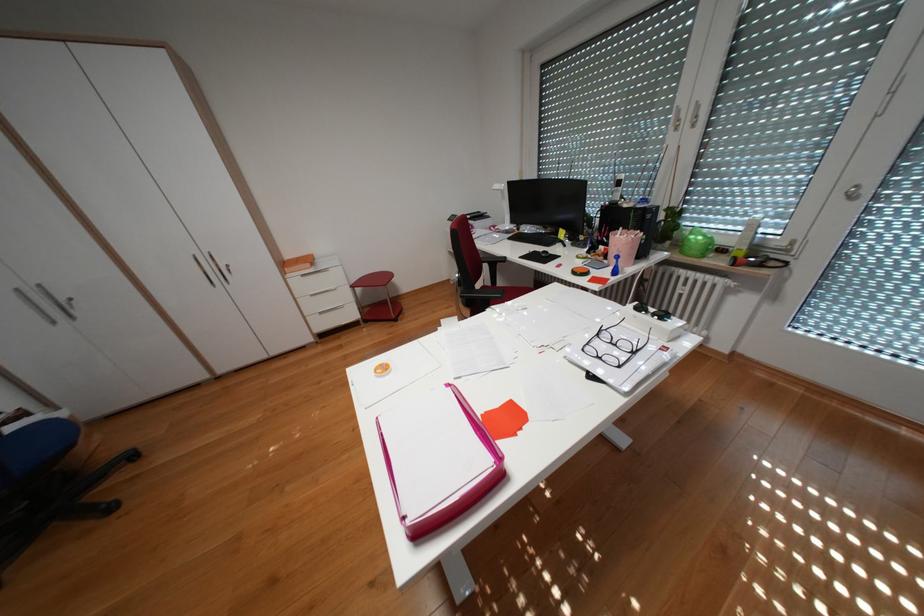
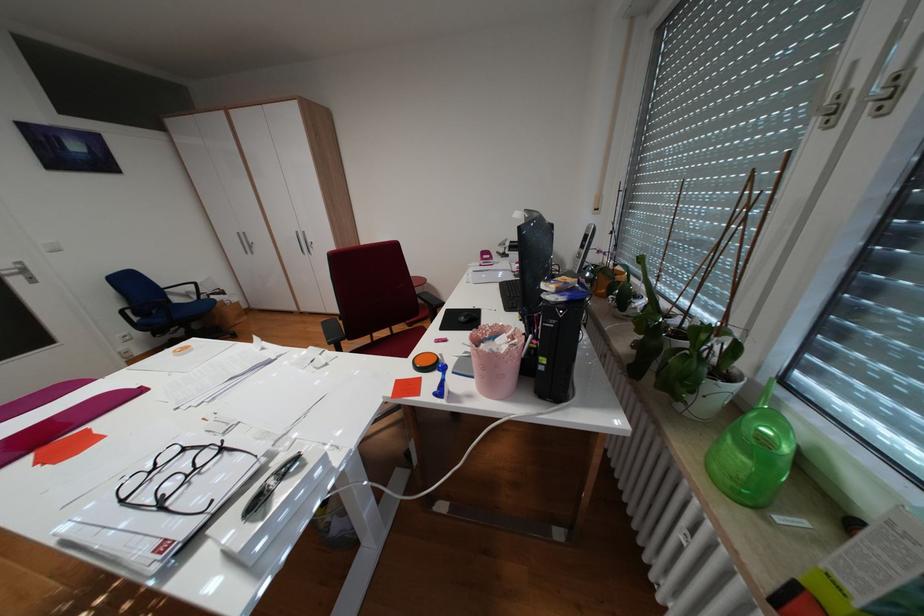
Find the pixel in the second image that matches (x=704, y=252) in the first image.

(727, 466)